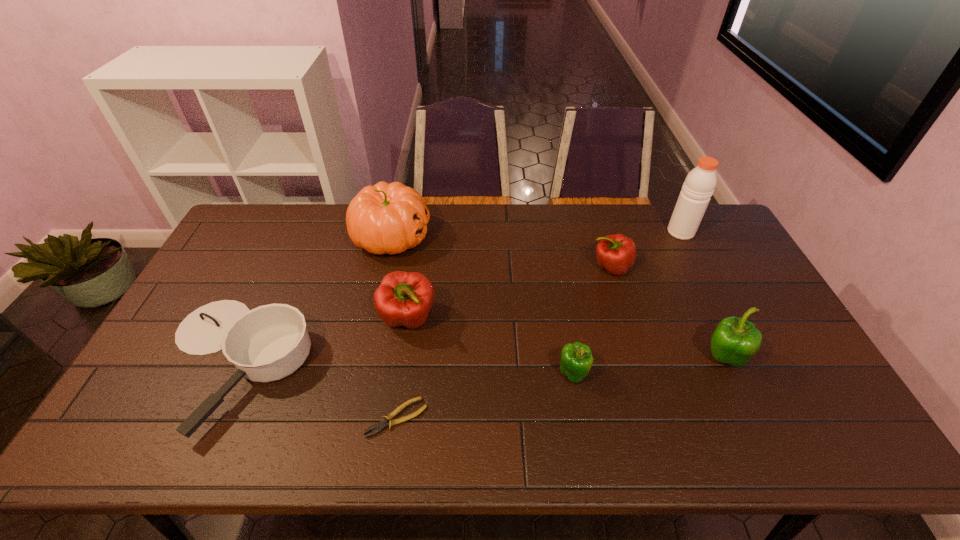
Locate an element on the screen. The width and height of the screenshot is (960, 540). free space at the far edge of the desktop is located at coordinates (661, 210).

In the image, there is a desktop. At what (x,y) coordinates should I click in order to perform the action: click on blank space at the left edge. Please return your answer as a coordinate pair (x, y). The width and height of the screenshot is (960, 540). Looking at the image, I should click on (148, 404).

At what (x,y) coordinates should I click in order to perform the action: click on blank space at the right edge of the desktop. Please return your answer as a coordinate pair (x, y). The height and width of the screenshot is (540, 960). Looking at the image, I should click on (730, 251).

Find the location of a particular element. This screenshot has height=540, width=960. free space at the far left corner of the desktop is located at coordinates (234, 240).

Locate an element on the screen. The width and height of the screenshot is (960, 540). vacant space at the near left corner of the desktop is located at coordinates (x=163, y=421).

Identify the location of free spot between the saucepan and the pumpkin. This screenshot has height=540, width=960. (312, 300).

The image size is (960, 540). In order to click on vacant area that lies between the bigger green bell pepper and the right pink bell pepper in this screenshot , I will do `click(666, 313)`.

Find the location of a particular element. This screenshot has width=960, height=540. free space between the shortest object and the leftmost bell pepper is located at coordinates coord(402,368).

You are a GUI agent. You are given a task and a screenshot of the screen. Output one action in this format:
    pyautogui.click(x=<x>, y=<y>)
    Task: Click on the free area in between the third object from right to left and the left green bell pepper
    
    Given the screenshot: What is the action you would take?
    pyautogui.click(x=592, y=321)

I want to click on vacant space that's between the leftmost bell pepper and the farther pink bell pepper, so click(510, 293).